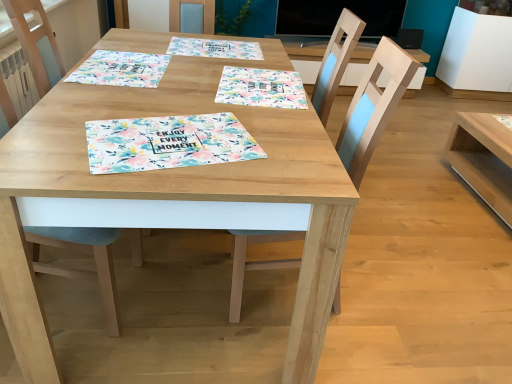
Identify the location of vacant area on top of floral paper placemat at center, marked as the first tablecloth in a right-to-left arrangement (from a real-world perspective). Image resolution: width=512 pixels, height=384 pixels. 253,79.